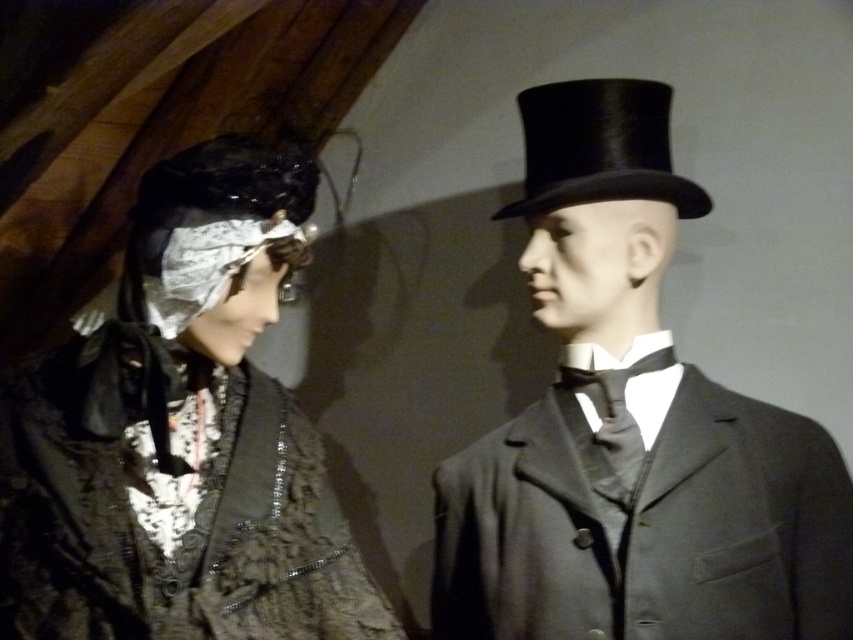
Can you confirm if matte black lace dress at left is shorter than black silk top hat at upper right?

A: No, matte black lace dress at left is not shorter than black silk top hat at upper right.

Is matte black lace dress at left smaller than black silk top hat at upper right?

No.

Who is more forward, (277,260) or (663,136)?

Point (277,260)

I want to click on matte black lace dress at left, so click(180, 436).

Between shiny black top hat at right and matte black lace dress at left, which one has less height?

matte black lace dress at left is shorter.

Is shiny black top hat at right to the left of matte black lace dress at left from the viewer's perspective?

No, shiny black top hat at right is not to the left of matte black lace dress at left.

Is point (837, 572) farther from viewer compared to point (317, 538)?

No, it is in front of (317, 538).

The image size is (853, 640). In order to click on shiny black top hat at right in this screenshot , I will do `click(631, 428)`.

Does shiny black top hat at right appear over black silk top hat at upper right?

No.

Does shiny black top hat at right have a greater width compared to black silk top hat at upper right?

Correct, the width of shiny black top hat at right exceeds that of black silk top hat at upper right.

Is point (494, 630) positioned after point (619, 83)?

No.

Find the location of `shiny black top hat at right`. shiny black top hat at right is located at coordinates (631, 428).